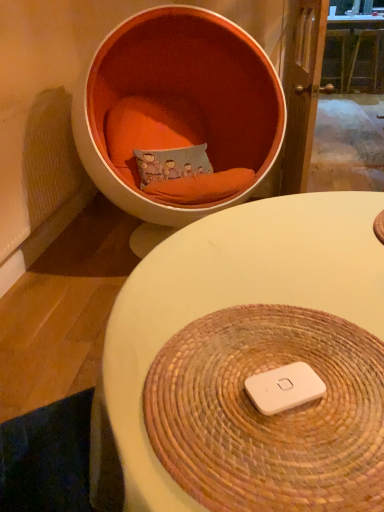
Question: Can you confirm if white matte/ipod at center is bigger than white woven placemat at center, marked as the 1th table in a bottom-to-top arrangement?

Choices:
 (A) no
 (B) yes

Answer: (A)

Question: From the image's perspective, would you say white matte/ipod at center is positioned over white woven placemat at center, arranged as the first table when viewed from the front?

Choices:
 (A) no
 (B) yes

Answer: (B)

Question: Is white matte/ipod at center shorter than white woven placemat at center, which is counted as the second table, starting from the back?

Choices:
 (A) yes
 (B) no

Answer: (A)

Question: From a real-world perspective, does white matte/ipod at center stand above white woven placemat at center, arranged as the 1th table when viewed from the left?

Choices:
 (A) yes
 (B) no

Answer: (A)

Question: From the image's perspective, is white matte/ipod at center under white woven placemat at center, which is counted as the second table, starting from the back?

Choices:
 (A) no
 (B) yes

Answer: (A)

Question: Is white woven placemat at center, which is counted as the second table, starting from the back, wider or thinner than wooden table at upper center, placed as the first table when sorted from back to front?

Choices:
 (A) thin
 (B) wide

Answer: (A)

Question: Considering their positions, is white woven placemat at center, marked as the 1th table in a bottom-to-top arrangement, located in front of or behind wooden table at upper center, the 1th table from the top?

Choices:
 (A) behind
 (B) front

Answer: (B)

Question: In terms of size, does white woven placemat at center, which is the 2th table from top to bottom, appear bigger or smaller than wooden table at upper center, the 1th table from the top?

Choices:
 (A) small
 (B) big

Answer: (A)

Question: Visually, is white woven placemat at center, arranged as the first table when viewed from the front, positioned to the left or to the right of wooden table at upper center, the 2th table from the left?

Choices:
 (A) right
 (B) left

Answer: (B)

Question: In terms of width, does white matte/ipod at center look wider or thinner when compared to textured fabric pillow at center?

Choices:
 (A) thin
 (B) wide

Answer: (A)

Question: Visually, is white matte/ipod at center positioned to the left or to the right of textured fabric pillow at center?

Choices:
 (A) left
 (B) right

Answer: (B)

Question: Considering their positions, is white matte/ipod at center located in front of or behind textured fabric pillow at center?

Choices:
 (A) behind
 (B) front

Answer: (B)

Question: Is white matte/ipod at center inside the boundaries of textured fabric pillow at center, or outside?

Choices:
 (A) inside
 (B) outside

Answer: (B)

Question: Based on their positions, is wooden table at upper center, the 2th table from the left, located to the left or right of orange fabric chair at upper left?

Choices:
 (A) right
 (B) left

Answer: (A)

Question: In the image, is wooden table at upper center, which is the first table from right to left, positioned in front of or behind orange fabric chair at upper left?

Choices:
 (A) behind
 (B) front

Answer: (A)